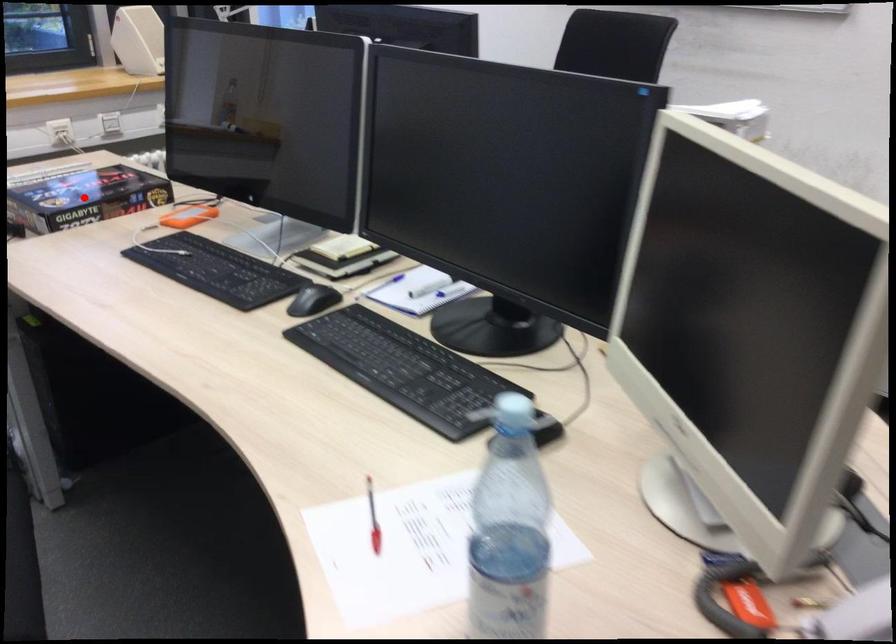
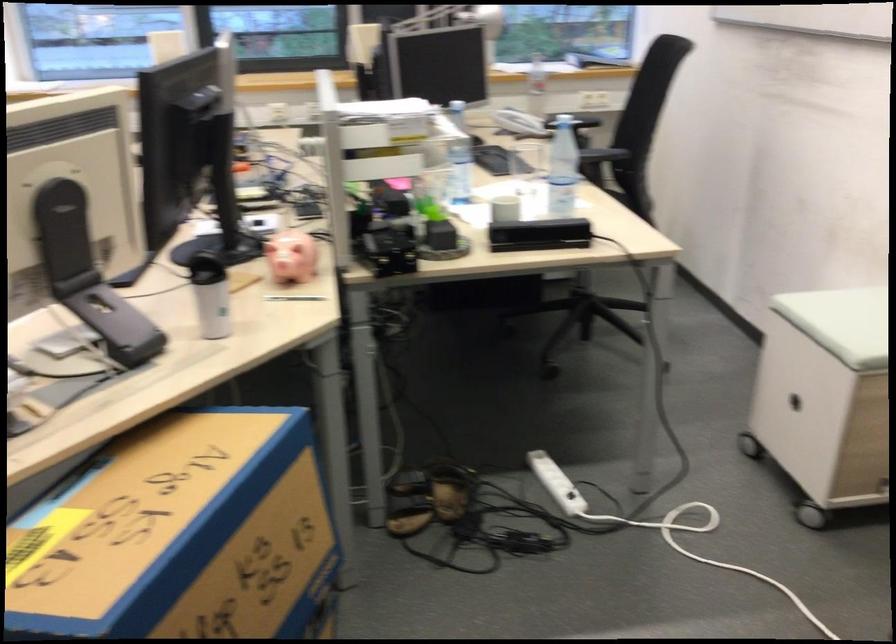
Question: I am providing you with two images of the same scene from different viewpoints. A red point is marked on the first image. At the location where the point appears in image 1, is it still visible in image 2?

Choices:
 (A) Yes
 (B) No

Answer: (B)